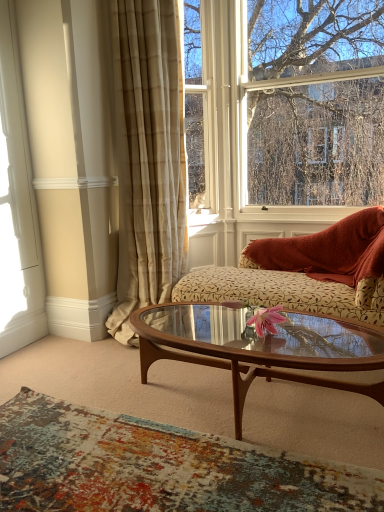
Question: Does point (306, 474) appear closer or farther from the camera than point (132, 135)?

Choices:
 (A) closer
 (B) farther

Answer: (A)

Question: In terms of size, does textured rug at lower center appear bigger or smaller than beige plaid curtain at center?

Choices:
 (A) small
 (B) big

Answer: (A)

Question: Which is farther from the beige plaid curtain at center?

Choices:
 (A) white wood window frame at left
 (B) textured rug at lower center
 (C) wooden glass coffee table at center
 (D) clear glass window at upper center
 (E) floral-patterned fabric couch at center

Answer: (B)

Question: Which is nearer to the clear glass window at upper center?

Choices:
 (A) white wood window frame at left
 (B) beige plaid curtain at center
 (C) textured rug at lower center
 (D) floral-patterned fabric couch at center
 (E) wooden glass coffee table at center

Answer: (D)